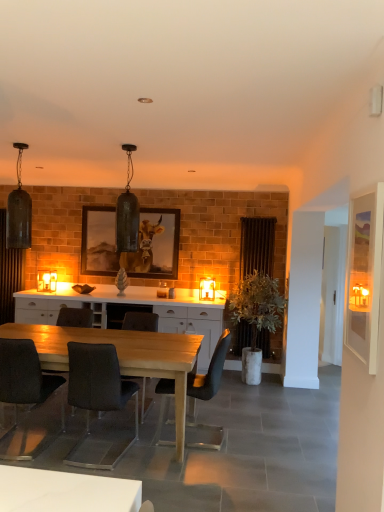
This screenshot has width=384, height=512. What are the coordinates of `blank space situated above matte black pendant light at upper left, marked as the third lamp in a right-to-left arrangement (from a real-world perspective)` in the screenshot? It's located at (25, 140).